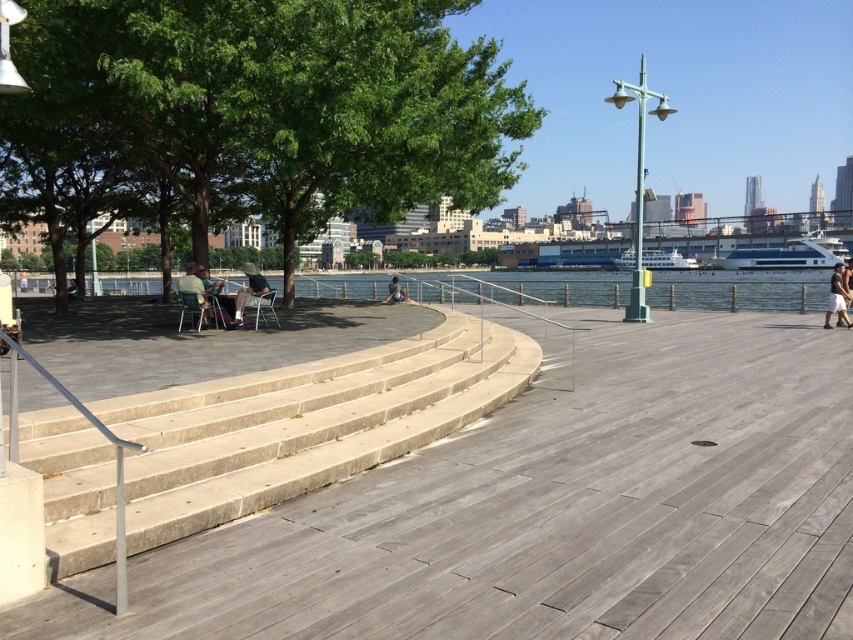
You are a visitor at this waterfront area and want to sit under the shade provided by the matte black umbrella at center. However, you notice the matte green chair at left is in the way. Can you move the chair to access the umbrella?

The matte green chair at left is located above the matte black umbrella at center, so moving the chair would allow you to access the umbrella.

You are standing on the boardwalk and want to sit down. There is a matte black chair at left and beige concrete stairs at left. Which object is closer to your current position if you are facing the water?

The matte black chair at left is closer to your current position because the beige concrete stairs at left are to the right of the chair, meaning the chair is positioned between you and the stairs when facing the water.

You are standing on the boardwalk and want to take a photo of the dark gray cotton shorts at right without the matte black umbrella at center blocking the view. Which direction should you move to ensure the umbrella is out of frame?

You should move to the left side of the boardwalk so that the matte black umbrella at center is behind you and no longer blocking the view of the dark gray cotton shorts at right.